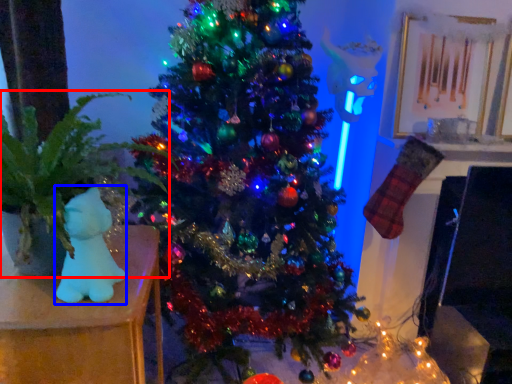
Question: Which object is further to the camera taking this photo, houseplant (highlighted by a red box) or toy (highlighted by a blue box)?

Choices:
 (A) houseplant
 (B) toy

Answer: (B)